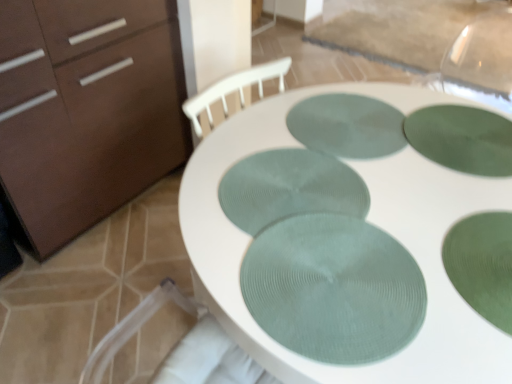
Identify the location of vacant area situated to the left side of green textured glass at center, positioned as the fourth glass plate in back-to-front order. (377, 274).